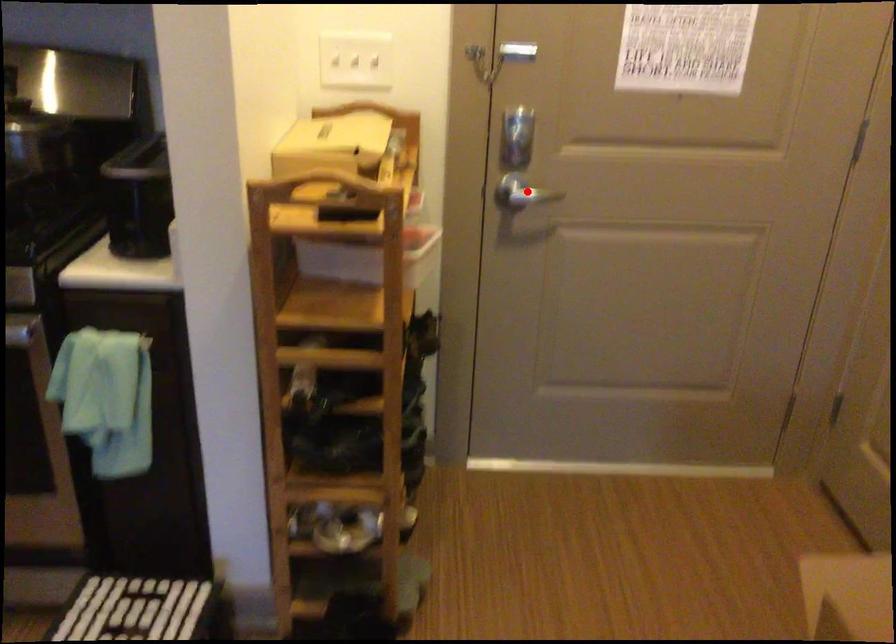
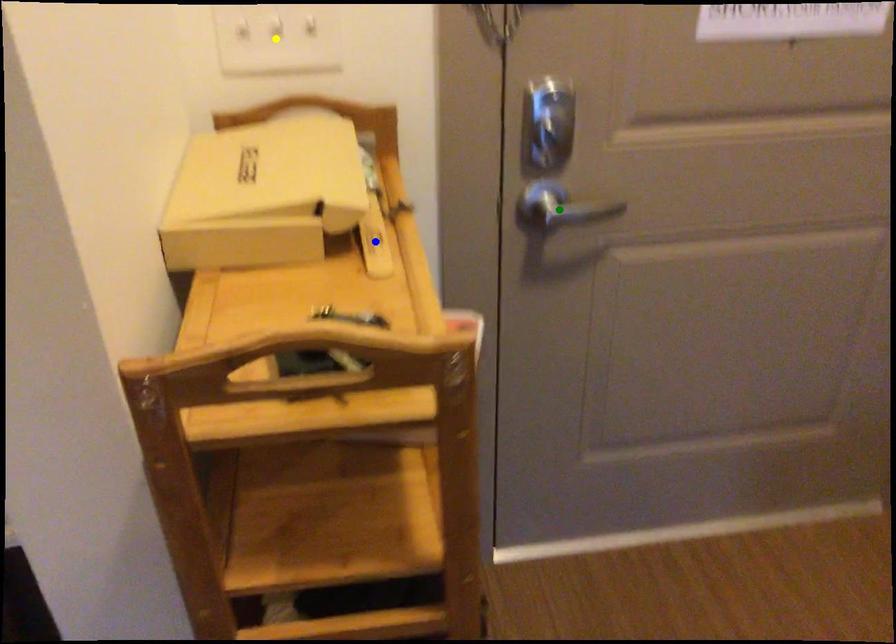
Question: I am providing you with two images of the same scene from different viewpoints. A red point is marked on the first image. You are given multiple points on the second image. Which point in image 2 represents the same 3d spot as the red point in image 1?

Choices:
 (A) yellow point
 (B) blue point
 (C) green point

Answer: (C)